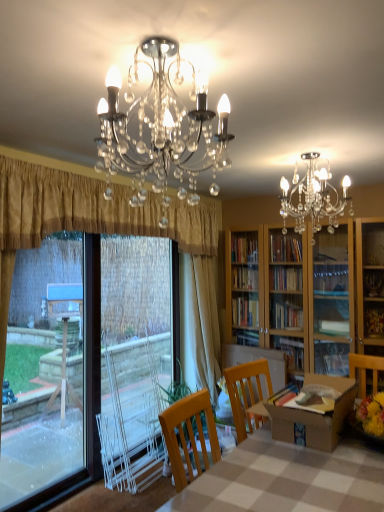
Describe the element at coordinates (79, 357) in the screenshot. I see `transparent plastic window screen at left` at that location.

This screenshot has height=512, width=384. Describe the element at coordinates (161, 128) in the screenshot. I see `clear crystal chandelier at upper center` at that location.

The image size is (384, 512). Find the location of `white plastic screen door at left`. white plastic screen door at left is located at coordinates (134, 359).

Identify the location of beige fabric curtain at center, placed as the first curtain when sorted from back to front. The image size is (384, 512). (199, 324).

Image resolution: width=384 pixels, height=512 pixels. I want to click on transparent plastic window screen at left, so click(79, 357).

Is checkerboard fabric table at center wider or thinner than gold textured curtain at left, placed as the second curtain when sorted from back to front?

Clearly, checkerboard fabric table at center has more width compared to gold textured curtain at left, placed as the second curtain when sorted from back to front.

Considering the relative sizes of checkerboard fabric table at center and gold textured curtain at left, placed as the second curtain when sorted from back to front, in the image provided, is checkerboard fabric table at center bigger than gold textured curtain at left, placed as the second curtain when sorted from back to front,?

Yes.

Considering the positions of objects checkerboard fabric table at center and gold textured curtain at left, placed as the second curtain when sorted from back to front, in the image provided, who is more to the left, checkerboard fabric table at center or gold textured curtain at left, placed as the second curtain when sorted from back to front,?

gold textured curtain at left, placed as the second curtain when sorted from back to front.

Is gold textured curtain at left, acting as the 1th curtain starting from the front, inside checkerboard fabric table at center?

No.

Locate an element on the screen. The width and height of the screenshot is (384, 512). box in front of the gold textured curtain at left, acting as the 1th curtain starting from the front is located at coordinates (312, 415).

Considering the relative sizes of brown cardboard box at center and gold textured curtain at left, placed as the second curtain when sorted from back to front, in the image provided, is brown cardboard box at center wider than gold textured curtain at left, placed as the second curtain when sorted from back to front,?

Yes.

Which point is more forward, (x=314, y=419) or (x=8, y=242)?

Positioned in front is point (x=314, y=419).

Does point (38, 255) appear closer or farther from the camera than point (205, 281)?

Point (38, 255).

From the picture: Who is bigger, transparent plastic window screen at left or beige fabric curtain at center, placed as the first curtain when sorted from back to front?

With larger size is beige fabric curtain at center, placed as the first curtain when sorted from back to front.

From a real-world perspective, is transparent plastic window screen at left over beige fabric curtain at center, placed as the first curtain when sorted from back to front?

No.

Looking at this image, considering the sizes of objects transparent plastic window screen at left and beige fabric curtain at center, the second curtain when ordered from front to back, in the image provided, who is shorter, transparent plastic window screen at left or beige fabric curtain at center, the second curtain when ordered from front to back,?

transparent plastic window screen at left is shorter.

In terms of size, does transparent plastic window screen at left appear bigger or smaller than white plastic screen door at left?

Considering their sizes, transparent plastic window screen at left takes up less space than white plastic screen door at left.

Is transparent plastic window screen at left inside or outside of white plastic screen door at left?

transparent plastic window screen at left is not inside white plastic screen door at left, it's outside.

Considering the points (137, 268) and (126, 404), which point is behind, point (137, 268) or point (126, 404)?

Positioned behind is point (137, 268).

Where is `window screen that is in front of the white plastic screen door at left`? This screenshot has width=384, height=512. window screen that is in front of the white plastic screen door at left is located at coordinates (79, 357).

From the picture: Are transparent plastic window screen at left and brown cardboard box at center making contact?

There is a gap between transparent plastic window screen at left and brown cardboard box at center.

Does transparent plastic window screen at left turn towards brown cardboard box at center?

Yes, transparent plastic window screen at left is aimed at brown cardboard box at center.

Is transparent plastic window screen at left thinner than brown cardboard box at center?

Indeed, transparent plastic window screen at left has a lesser width compared to brown cardboard box at center.

Would you say checkerboard fabric table at center is a long distance from brown cardboard box at center?

No, checkerboard fabric table at center is not far away from brown cardboard box at center.

Is checkerboard fabric table at center looking in the opposite direction of brown cardboard box at center?

That's not correct — checkerboard fabric table at center is not looking away from brown cardboard box at center.

Looking at this image, is checkerboard fabric table at center bigger or smaller than brown cardboard box at center?

checkerboard fabric table at center is bigger than brown cardboard box at center.

Is checkerboard fabric table at center positioned beyond the bounds of brown cardboard box at center?

That's correct, checkerboard fabric table at center is outside of brown cardboard box at center.

Is point (213, 380) closer or farther from the camera than point (161, 69)?

Point (213, 380).

Looking at this image, can we say beige fabric curtain at center, the second curtain when ordered from front to back, lies outside clear crystal chandelier at upper center?

Indeed, beige fabric curtain at center, the second curtain when ordered from front to back, is completely outside clear crystal chandelier at upper center.

This screenshot has width=384, height=512. In order to click on curtain that is the 2nd one when counting upward from the checkerboard fabric table at center (from the image's perspective) in this screenshot , I will do tap(93, 210).

The height and width of the screenshot is (512, 384). What are the coordinates of `box below the gold textured curtain at left, placed as the second curtain when sorted from back to front (from a real-world perspective)` in the screenshot? It's located at (x=312, y=415).

Considering their positions, is checkerboard fabric table at center positioned further to beige fabric curtain at center, placed as the first curtain when sorted from back to front, than brown cardboard box at center?

Based on the image, checkerboard fabric table at center appears to be further to beige fabric curtain at center, placed as the first curtain when sorted from back to front.

Which object lies nearer to the anchor point white plastic screen door at left, beige fabric curtain at center, placed as the first curtain when sorted from back to front, or checkerboard fabric table at center?

beige fabric curtain at center, placed as the first curtain when sorted from back to front, is closer to white plastic screen door at left.

From the image, which object appears to be farther from beige fabric curtain at center, the second curtain when ordered from front to back, gold textured curtain at left, acting as the 1th curtain starting from the front, or checkerboard fabric table at center?

Based on the image, checkerboard fabric table at center appears to be further to beige fabric curtain at center, the second curtain when ordered from front to back.

Considering their positions, is clear crystal chandelier at upper center positioned further to beige fabric curtain at center, the second curtain when ordered from front to back, than checkerboard fabric table at center?

clear crystal chandelier at upper center.

Considering their positions, is brown cardboard box at center positioned closer to clear crystal chandelier at upper center than transparent plastic window screen at left?

Based on the image, brown cardboard box at center appears to be nearer to clear crystal chandelier at upper center.

Estimate the real-world distances between objects in this image. Which object is further from checkerboard fabric table at center, gold textured curtain at left, placed as the second curtain when sorted from back to front, or transparent plastic window screen at left?

The object further to checkerboard fabric table at center is gold textured curtain at left, placed as the second curtain when sorted from back to front.

Considering their positions, is transparent plastic window screen at left positioned closer to white plastic screen door at left than checkerboard fabric table at center?

The object closer to white plastic screen door at left is transparent plastic window screen at left.

Which object lies nearer to the anchor point clear crystal chandelier at upper center, checkerboard fabric table at center or beige fabric curtain at center, the second curtain when ordered from front to back?

Among the two, checkerboard fabric table at center is located nearer to clear crystal chandelier at upper center.

The width and height of the screenshot is (384, 512). What are the coordinates of `table between clear crystal chandelier at upper center and beige fabric curtain at center, the second curtain when ordered from front to back, from front to back` in the screenshot? It's located at (287, 479).

Identify the location of window screen between gold textured curtain at left, acting as the 1th curtain starting from the front, and beige fabric curtain at center, placed as the first curtain when sorted from back to front, from front to back. The height and width of the screenshot is (512, 384). (79, 357).

You are a GUI agent. You are given a task and a screenshot of the screen. Output one action in this format:
    pyautogui.click(x=<x>, y=<y>)
    Task: Click on the curtain between clear crystal chandelier at upper center and beige fabric curtain at center, the second curtain when ordered from front to back, from front to back
    The width and height of the screenshot is (384, 512).
    Given the screenshot: What is the action you would take?
    pyautogui.click(x=93, y=210)

This screenshot has height=512, width=384. In order to click on screen door between brown cardboard box at center and beige fabric curtain at center, the second curtain when ordered from front to back, from front to back in this screenshot , I will do `click(134, 359)`.